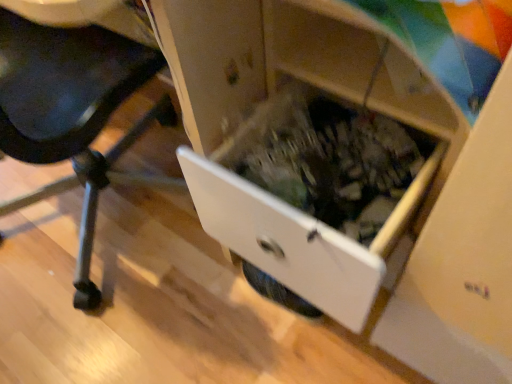
Question: From a real-world perspective, is wooden drawer at center positioned under white plastic drawer at lower right based on gravity?

Choices:
 (A) yes
 (B) no

Answer: (A)

Question: Does wooden drawer at center appear on the right side of white plastic drawer at lower right?

Choices:
 (A) no
 (B) yes

Answer: (B)

Question: Are wooden drawer at center and white plastic drawer at lower right located far from each other?

Choices:
 (A) yes
 (B) no

Answer: (B)

Question: Is wooden drawer at center shorter than white plastic drawer at lower right?

Choices:
 (A) no
 (B) yes

Answer: (B)

Question: Can you confirm if wooden drawer at center is bigger than white plastic drawer at lower right?

Choices:
 (A) no
 (B) yes

Answer: (A)

Question: Is wooden drawer at center outside white plastic drawer at lower right?

Choices:
 (A) yes
 (B) no

Answer: (A)

Question: From a real-world perspective, is white plastic drawer at lower right physically above wooden drawer at center?

Choices:
 (A) yes
 (B) no

Answer: (A)

Question: Is white plastic drawer at lower right in front of wooden drawer at center?

Choices:
 (A) no
 (B) yes

Answer: (B)

Question: From the image's perspective, would you say white plastic drawer at lower right is positioned over wooden drawer at center?

Choices:
 (A) no
 (B) yes

Answer: (B)

Question: From the image's perspective, is white plastic drawer at lower right beneath wooden drawer at center?

Choices:
 (A) no
 (B) yes

Answer: (A)

Question: Is white plastic drawer at lower right beside wooden drawer at center?

Choices:
 (A) yes
 (B) no

Answer: (B)

Question: Does white plastic drawer at lower right appear on the left side of wooden drawer at center?

Choices:
 (A) no
 (B) yes

Answer: (B)

Question: Based on their positions, is white plastic drawer at lower right located to the left or right of wooden drawer at center?

Choices:
 (A) right
 (B) left

Answer: (B)